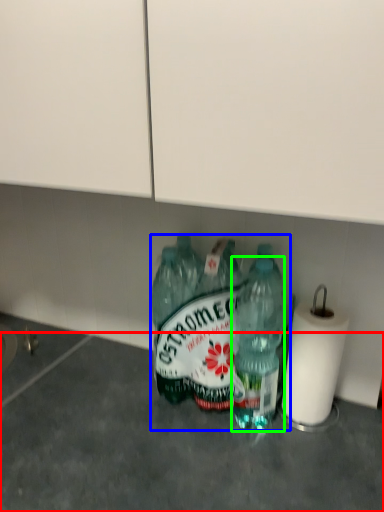
Question: Which is farther away from concrete (highlighted by a red box)? bottle (highlighted by a blue box) or bottle (highlighted by a green box)?

Choices:
 (A) bottle
 (B) bottle

Answer: (B)